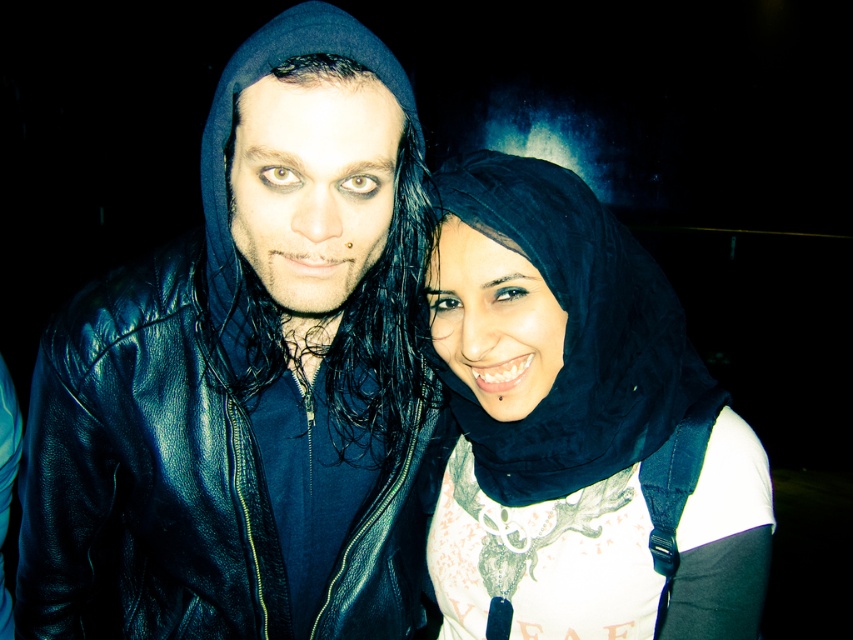
You are a photographer trying to decide where to place a spotlight in this image. You need to ensure the spotlight can cover both the black leather jacket at left and the black matte hijab at center without overlapping. Given their sizes, is this possible?

The black leather jacket at left is bigger than the black matte hijab at center, so the spotlight can be positioned to cover both without overlapping as long as the larger jacket is accommodated first.

You are a photographer trying to capture a portrait of the two people in the image. You want to ensure that both the black leather jacket at left and the black matte hijab at center are clearly visible in the frame. Given their sizes, which object should you focus on first to ensure proper exposure?

The black leather jacket at left is much taller than the black matte hijab at center, so focusing on the larger object first will help balance the exposure for both subjects.

You are a photographer trying to capture a closeup shot of both the black leather jacket at left and the black matte hijab at center. Given that your camera can only focus on objects within a 7 inch range, will you be able to get both items in focus?

The black leather jacket at left is 8.04 inches away from the black matte hijab at center, which exceeds the camera focus range of 7 inches. Therefore, both items cannot be in focus simultaneously.